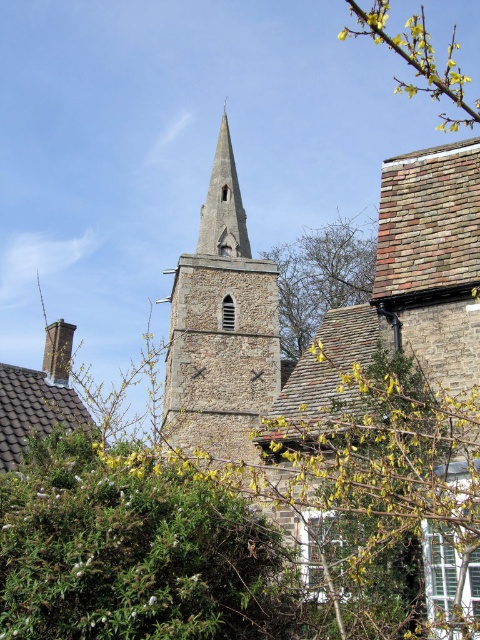
You are standing at the base of the historic stone church tower and looking towards the spire. There are two points marked on the tower, one at coordinates point (397, 77) and the other at point (226, 200). Which point is closer to the base of the tower?

Point (226, 200) is closer to the base of the tower because it is in front of point (397, 77), which is further away from the base.

You are standing in front of the historic stone church tower and notice two points marked on the tower. The first point is at coordinates point (231, 360) and the second is at point (316, 236). Which point is closer to you?

Point (231, 360) is in front of point (316, 236), so the first point is closer to you.

You are standing at the camera position and want to take a photo of the yellow flower at upper right. If your camera has a maximum zoom range of 100 feet, will you be able to capture the flower clearly?

The yellow flower at upper right and camera are 81.76 feet apart. Since the maximum zoom range of the camera is 100 feet, the distance of 81.76 feet is within the camera range. Therefore, you can capture the flower clearly.